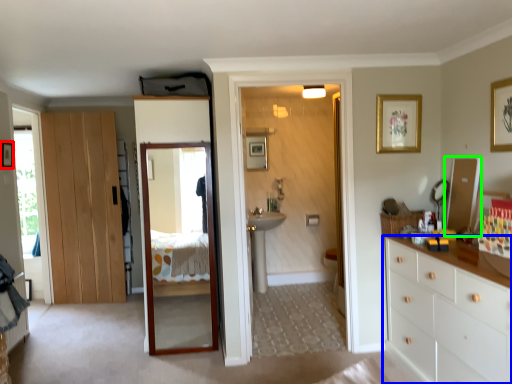
Question: Estimate the real-world distances between objects in this image. Which object is farther from picture frame (highlighted by a red box), chest of drawers (highlighted by a blue box) or mirror (highlighted by a green box)?

Choices:
 (A) chest of drawers
 (B) mirror

Answer: (A)